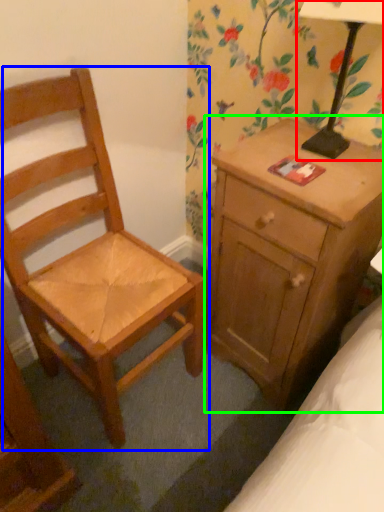
Question: Which object is the closest to the table lamp (highlighted by a red box)? Choose among these: chair (highlighted by a blue box) or nightstand (highlighted by a green box).

Choices:
 (A) chair
 (B) nightstand

Answer: (B)